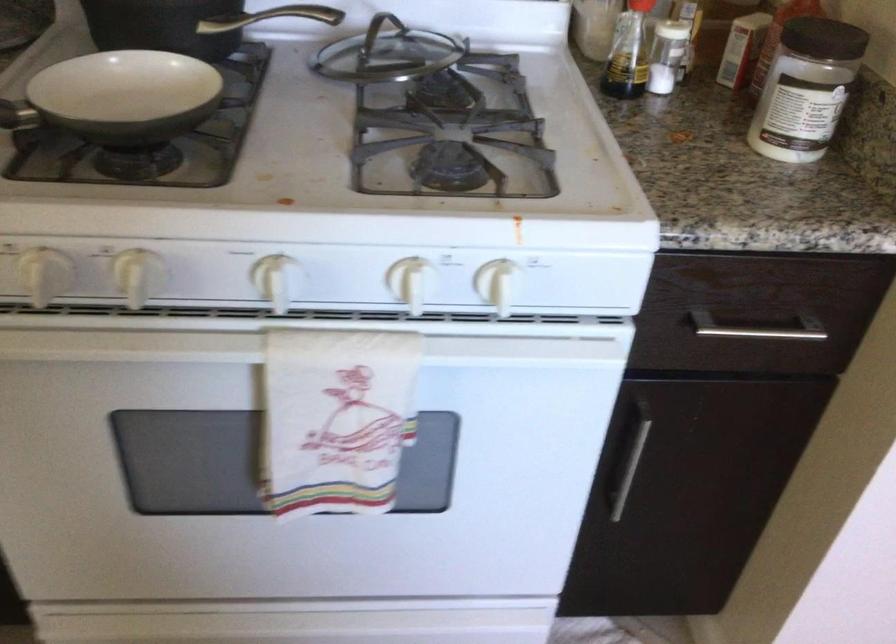
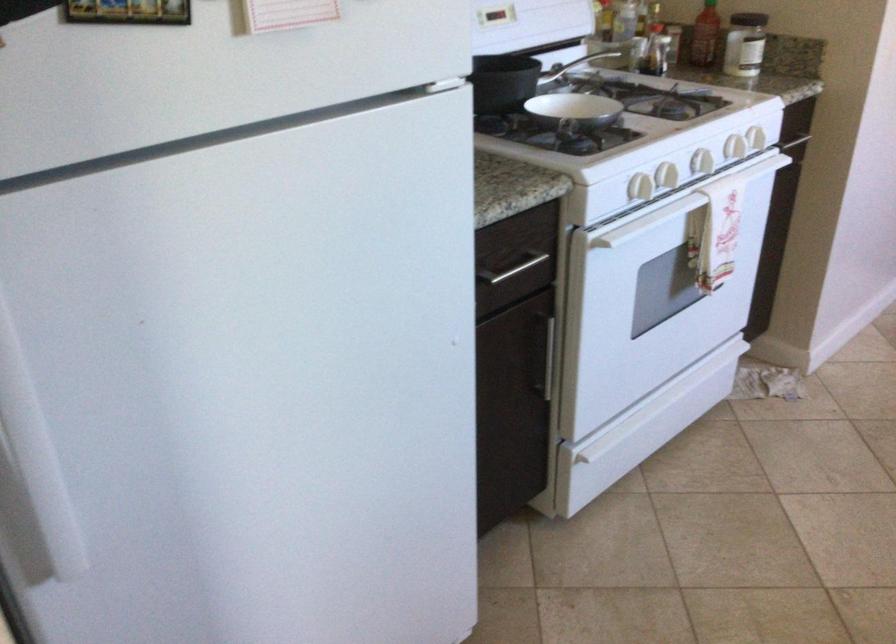
The point at [389,357] is marked in the first image. Where is the corresponding point in the second image?

(755, 138)